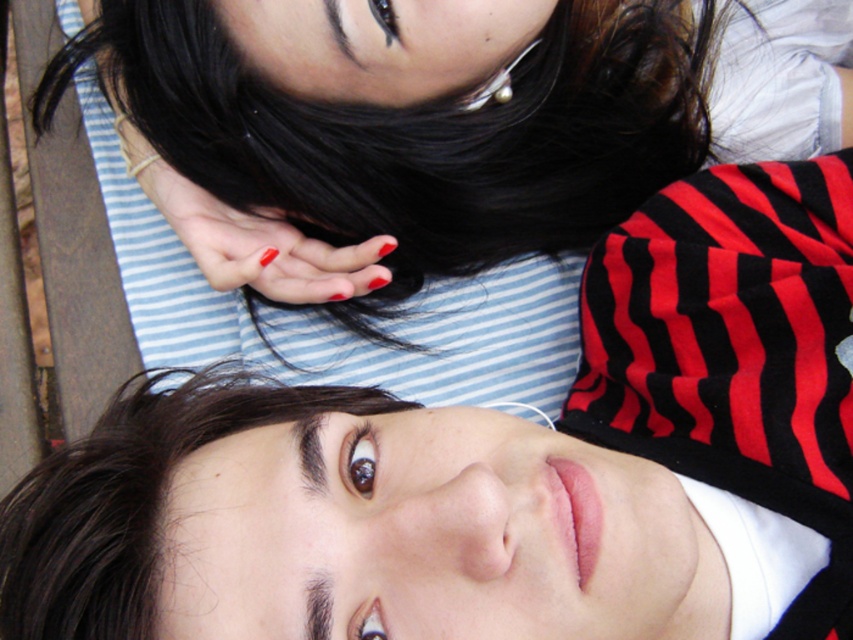
You are a photographer trying to capture a close detail shot of the dark brown shiny hair at upper center and the glossy nail polish at center. Which object should you focus on first if you want to ensure both are in focus without adjusting the camera settings?

The dark brown shiny hair at upper center is larger in size than the glossy nail polish at center, so you should focus on the larger object first to ensure both are in focus.

You are a photographer adjusting the lighting in the scene. You need to ensure that both the dark brown shiny hair at upper center and the glossy nail polish at center are well lit. Based on their positions, which object should you adjust the light towards first?

The dark brown shiny hair at upper center is positioned under the glossy nail polish at center. To light both effectively, adjust the light towards the glossy nail polish at center first since it is above the hair and will cast light downward, ensuring both areas receive adequate illumination.

You are a photographer trying to capture a close shot of the glossy nail polish at center. You want to ensure the dark brown shiny hair at upper center doesn t block the view. Based on their positions, which direction should you move the camera to frame the nail polish without the hair obstructing it?

The dark brown shiny hair at upper center is to the left of the glossy nail polish at center. To avoid obstruction, move the camera to the right so the nail polish is framed away from the hair.